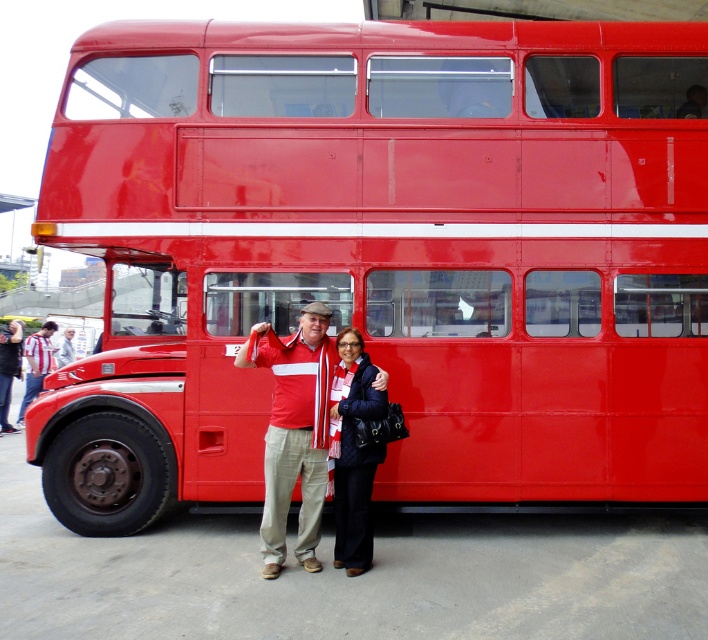
You are a photographer trying to capture both the quilted black jacket at lower center and the striped fabric shirt at left in a single frame. Based on their sizes, which object should you focus on first to ensure both are in focus?

The quilted black jacket at lower center is smaller than the striped fabric shirt at left, so you should focus on the striped fabric shirt at left first to ensure both are in focus.

You are a photographer trying to capture a photo of the two people in front of the red double decker bus. The subjects are wearing a matte red shirt at center and a quilted black jacket at lower center. Which subject should you focus on first if you want to capture the one closer to the left side?

The matte red shirt at center is to the left of the quilted black jacket at lower center, so you should focus on the matte red shirt at center first as it is closer to the left side.